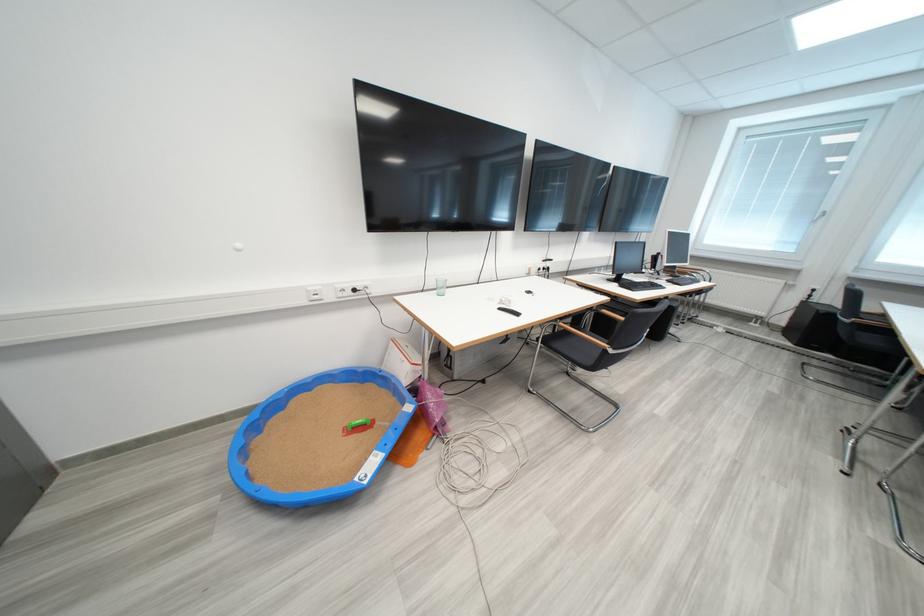
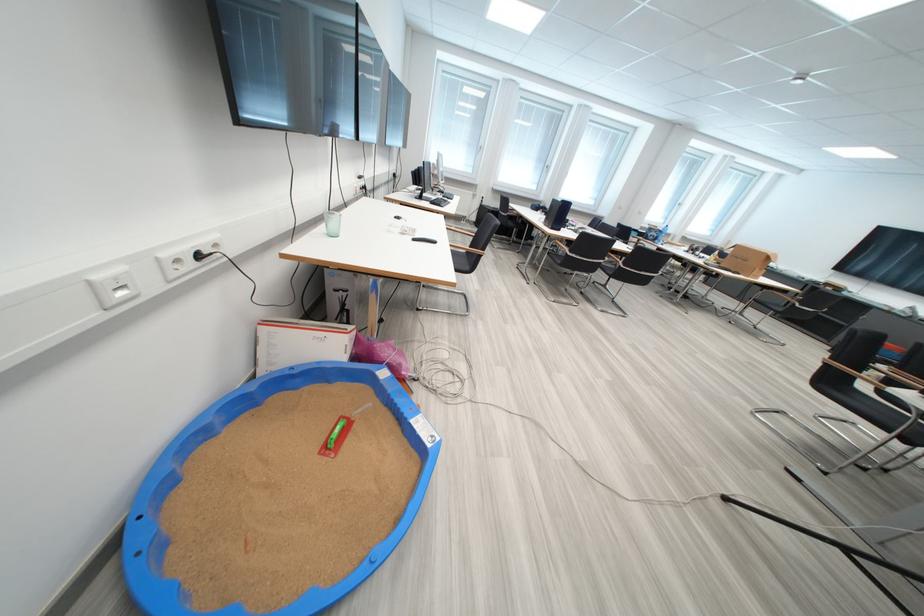
Where in the second image is the point corresponding to (511,312) from the first image?

(424, 241)